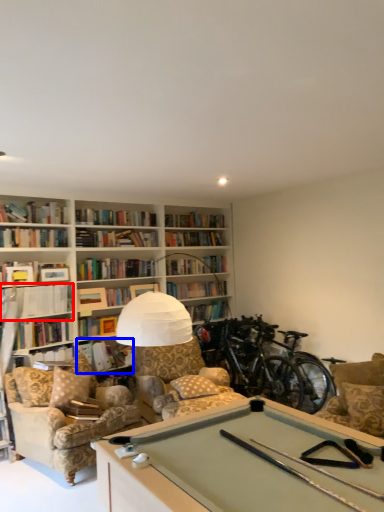
Question: Among these objects, which one is nearest to the camera, book (highlighted by a red box) or book (highlighted by a blue box)?

Choices:
 (A) book
 (B) book

Answer: (A)